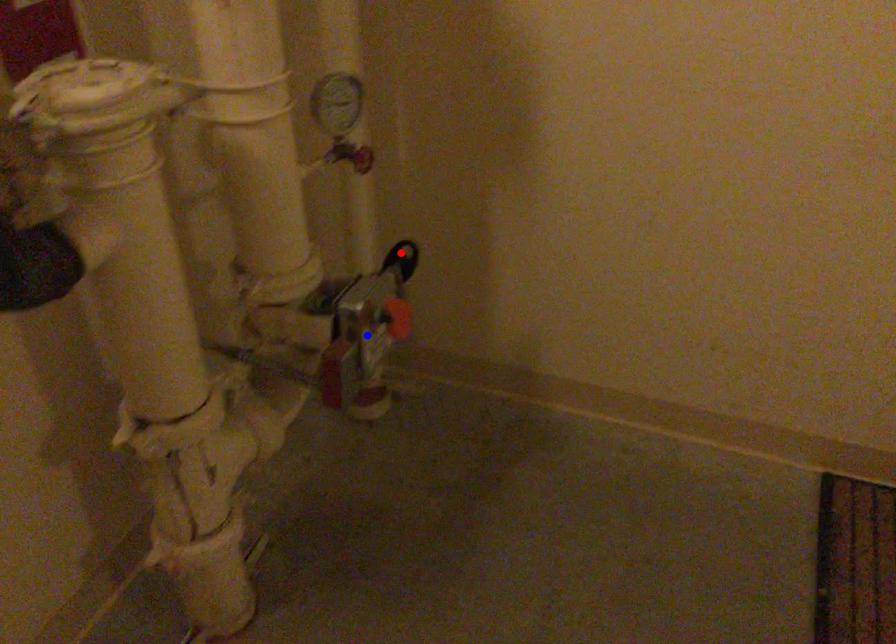
Question: Which of the two points in the image is closer to the camera?

Choices:
 (A) Blue point is closer.
 (B) Red point is closer.

Answer: (A)